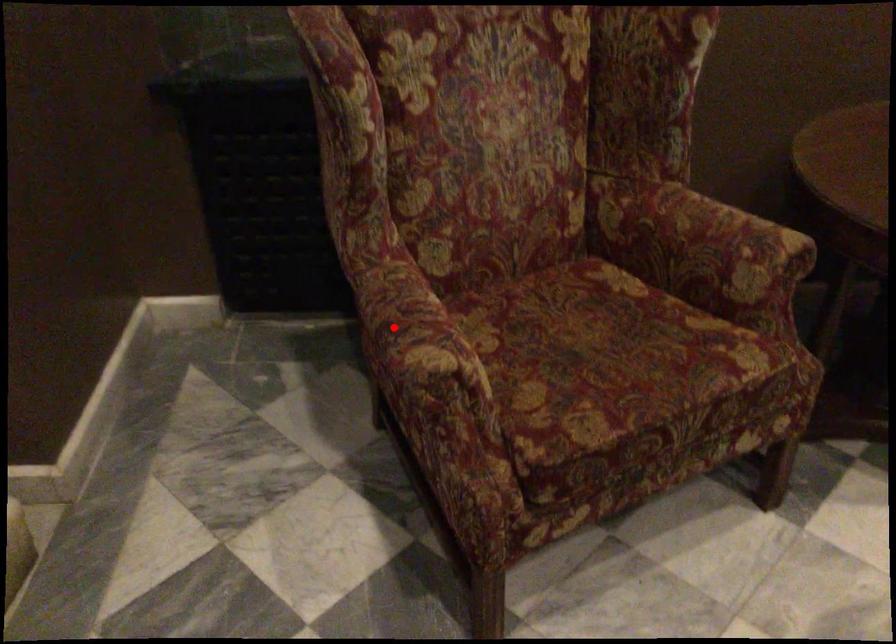
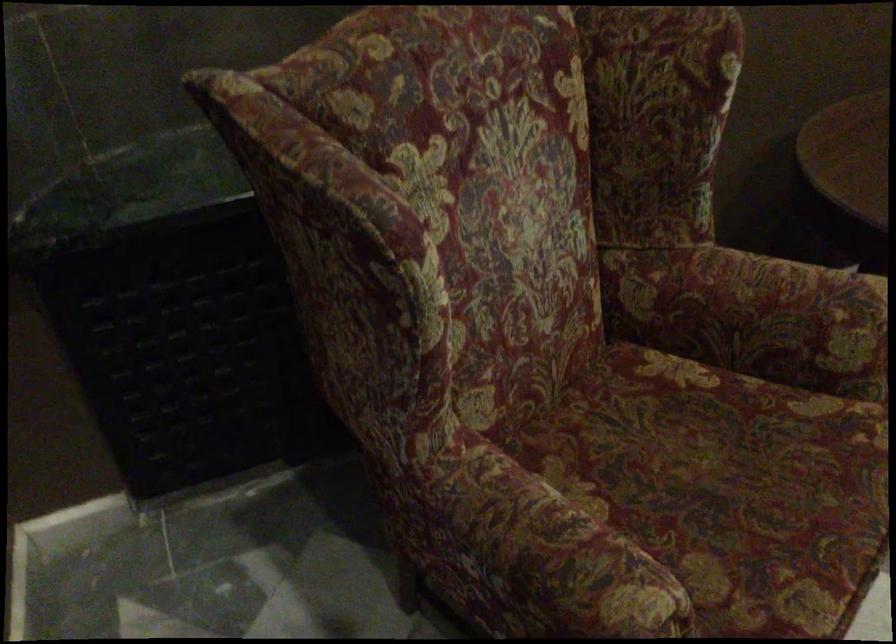
Locate, in the second image, the point that corresponds to the highlighted location in the first image.

(543, 559)